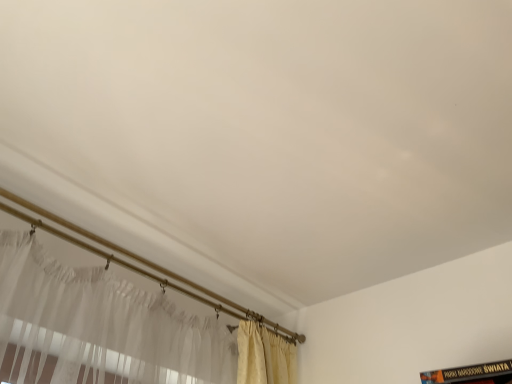
Question: In the image, is white sheer curtain at lower left positioned in front of or behind black matte book at lower right?

Choices:
 (A) behind
 (B) front

Answer: (A)

Question: Based on their positions, is white sheer curtain at lower left located to the left or right of black matte book at lower right?

Choices:
 (A) right
 (B) left

Answer: (B)

Question: From a real-world perspective, is white sheer curtain at lower left above or below black matte book at lower right?

Choices:
 (A) below
 (B) above

Answer: (B)

Question: Which is correct: black matte book at lower right is inside white sheer curtain at lower left, or outside of it?

Choices:
 (A) inside
 (B) outside

Answer: (B)

Question: Looking at their shapes, would you say black matte book at lower right is wider or thinner than white sheer curtain at lower left?

Choices:
 (A) wide
 (B) thin

Answer: (A)

Question: Looking at the image, does black matte book at lower right seem bigger or smaller compared to white sheer curtain at lower left?

Choices:
 (A) small
 (B) big

Answer: (A)

Question: Considering the positions of black matte book at lower right and white sheer curtain at lower left in the image, is black matte book at lower right taller or shorter than white sheer curtain at lower left?

Choices:
 (A) short
 (B) tall

Answer: (B)